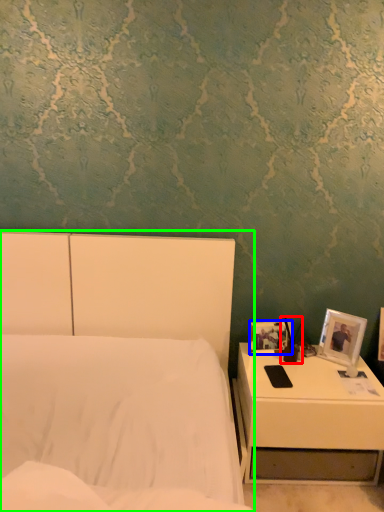
Question: Which object is the closest to the bedside lamp (highlighted by a red box)? Choose among these: picture frame (highlighted by a blue box) or bed (highlighted by a green box).

Choices:
 (A) picture frame
 (B) bed

Answer: (A)